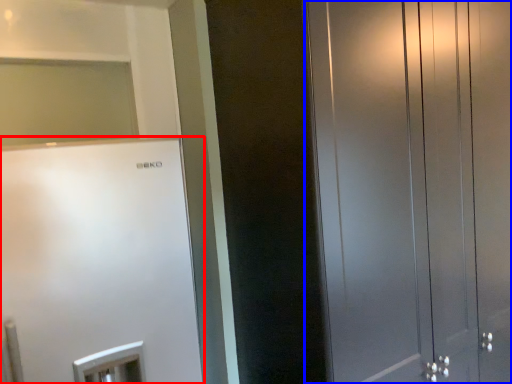
Question: Among these objects, which one is farthest to the camera, refrigerator (highlighted by a red box) or door (highlighted by a blue box)?

Choices:
 (A) refrigerator
 (B) door

Answer: (B)